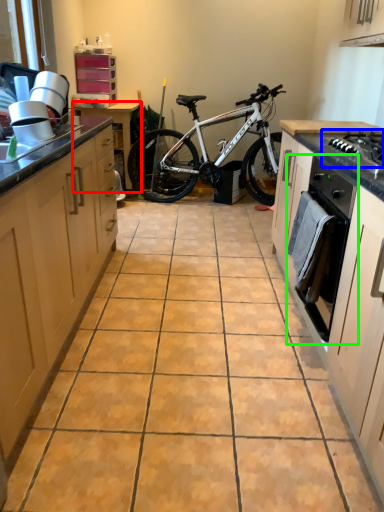
Question: Which object is positioned closest to table (highlighted by a red box)? Select from gas stove (highlighted by a blue box) and oven (highlighted by a green box).

Choices:
 (A) gas stove
 (B) oven

Answer: (B)